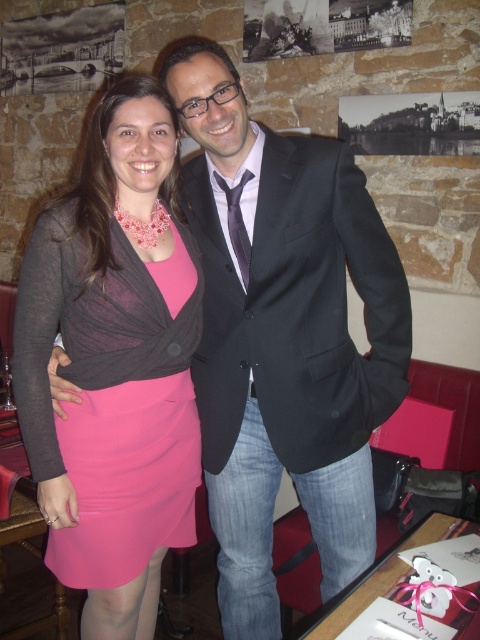
Question: Which object is farther from the camera taking this photo?

Choices:
 (A) pink satin dress at center
 (B) black smooth suit at center

Answer: (A)

Question: From the image, what is the correct spatial relationship of pink satin dress at center in relation to black smooth suit at center?

Choices:
 (A) above
 (B) below

Answer: (B)

Question: Which of the following is the farthest from the observer?

Choices:
 (A) (253, 307)
 (B) (127, 394)

Answer: (B)

Question: Observing the image, what is the correct spatial positioning of pink satin dress at center in reference to black smooth suit at center?

Choices:
 (A) below
 (B) above

Answer: (A)

Question: Does pink satin dress at center have a smaller size compared to black smooth suit at center?

Choices:
 (A) no
 (B) yes

Answer: (A)